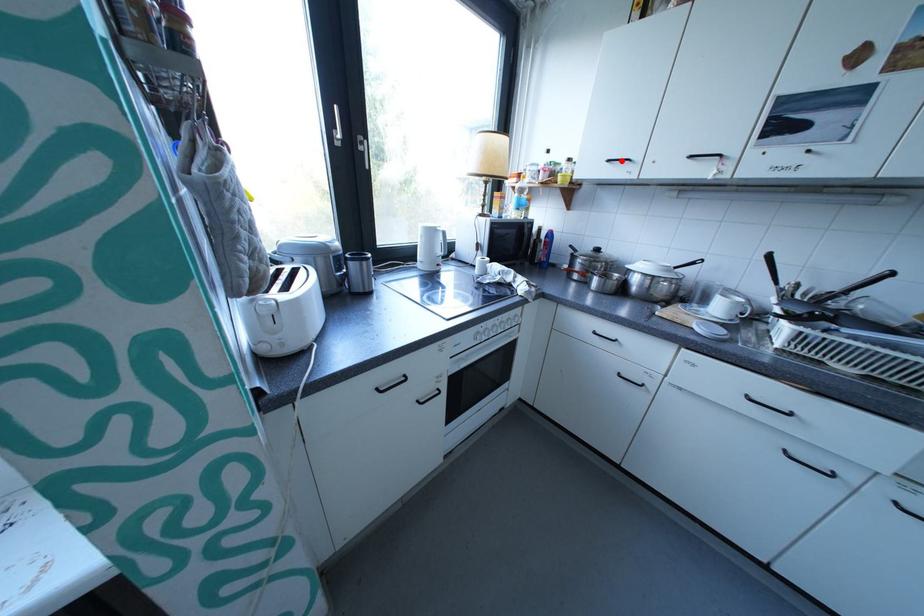
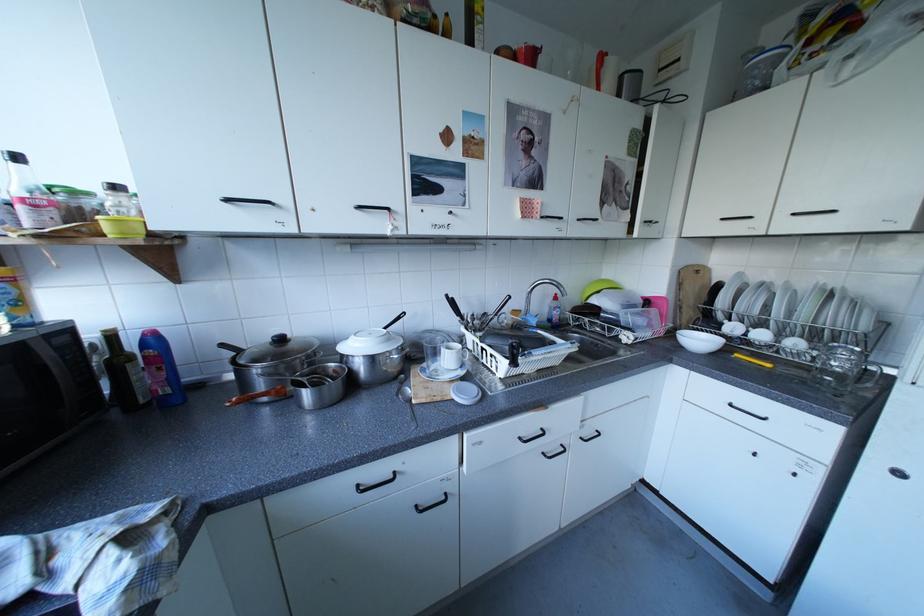
The point at the highlighted location is marked in the first image. Where is the corresponding point in the second image?

(240, 200)